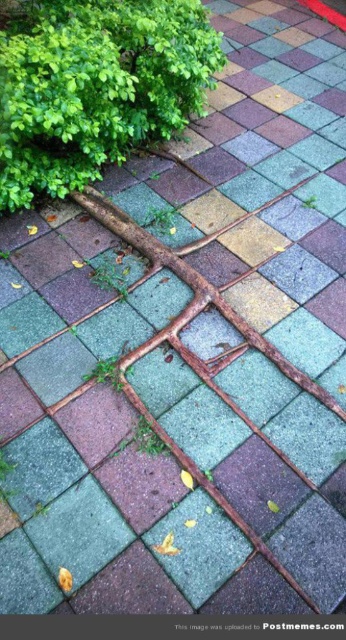
Between green leafy bush at upper left and rusty metal tree root at center, which one appears on the left side from the viewer's perspective?

green leafy bush at upper left

Image resolution: width=346 pixels, height=640 pixels. I want to click on green leafy bush at upper left, so click(97, 88).

What are the coordinates of `green leafy bush at upper left` in the screenshot? It's located at (97, 88).